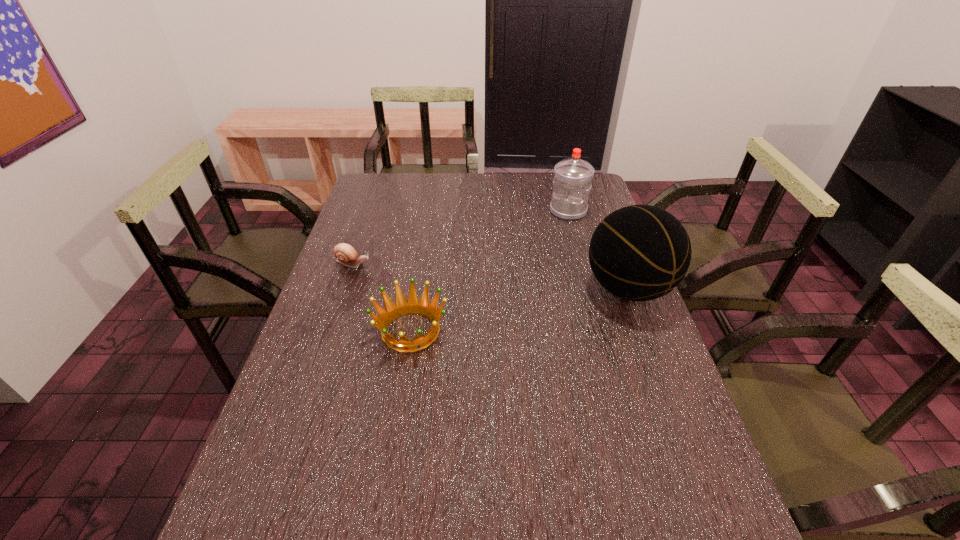
The image size is (960, 540). I want to click on free spot on the desktop that is between the second object from left to right and the basketball and is positioned on the handle side of the water bottle, so click(x=496, y=314).

Identify the location of free spot on the desktop that is between the second shortest object and the basketball and is positioned on the front-facing side of the shortest object. (554, 303).